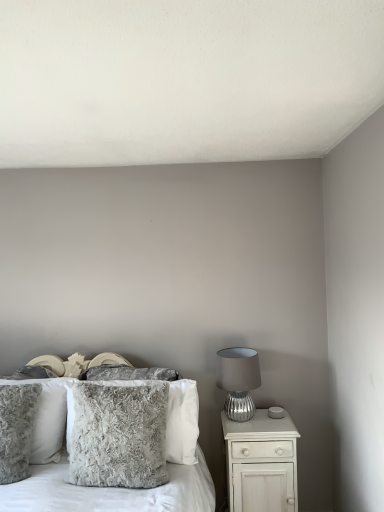
Identify the location of empty space that is ontop of white glossy nightstand at right (from a real-world perspective). pyautogui.click(x=256, y=418).